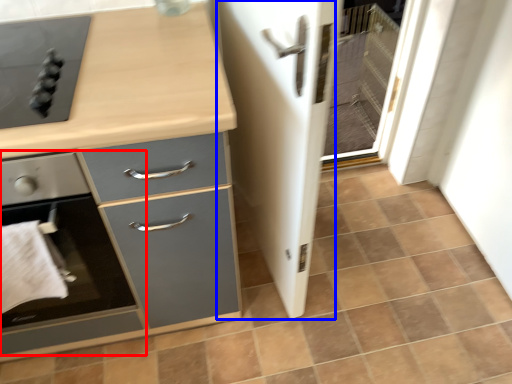
Question: Which object appears closest to the camera in this image, home appliance (highlighted by a red box) or screen door (highlighted by a blue box)?

Choices:
 (A) home appliance
 (B) screen door

Answer: (B)